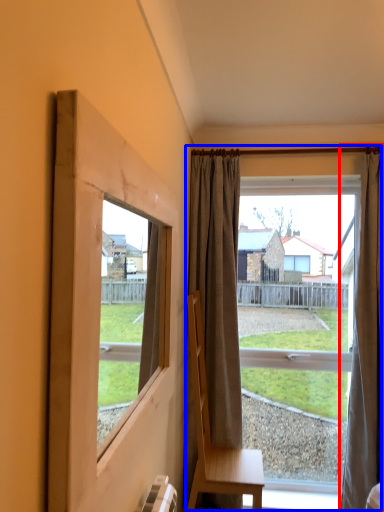
Question: Among these objects, which one is farthest to the camera, curtain (highlighted by a red box) or window (highlighted by a blue box)?

Choices:
 (A) curtain
 (B) window

Answer: (B)